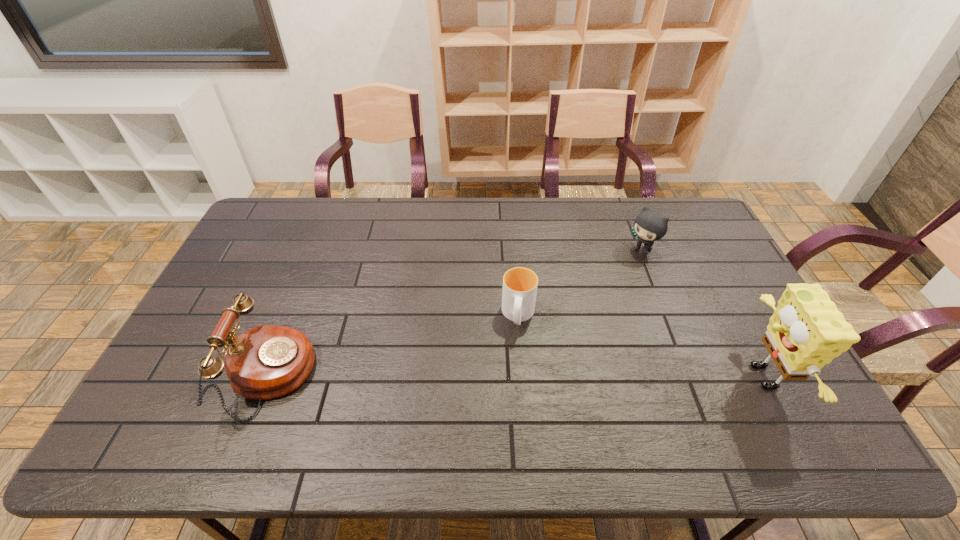
Find the location of a particular element. The height and width of the screenshot is (540, 960). vacant space that satisfies the following two spatial constraints: 1. on the front side of the shortest object; 2. on the front-facing side of the rightmost object is located at coordinates (523, 376).

This screenshot has width=960, height=540. What are the coordinates of `blank area in the image that satisfies the following two spatial constraints: 1. on the front side of the sponge; 2. on the front-facing side of the farthest object` in the screenshot? It's located at (690, 376).